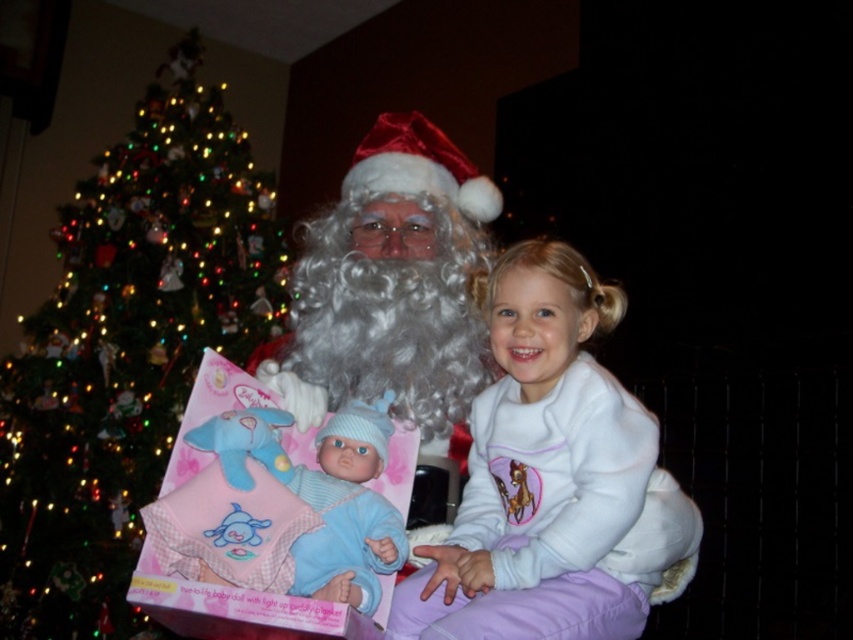
You are standing in front of the festive holiday scene with Santa Claus and the girl. There are two points marked in the image. Point A is at coordinates point (520, 356) and Point B is at coordinates point (408, 154). Which point is closer to you?

Result: Point A at coordinates point (520, 356) is closer to the viewer than point B at coordinates point (408, 154).

You are organizing a holiday photo shoot and need to ensure that the white fleece at center and the white fluffy santa at center are positioned properly. Based on their sizes, which object should be placed closer to the camera to maintain visual balance?

The white fleece at center has a lesser width compared to the white fluffy santa at center. To maintain visual balance, the smaller white fleece at center should be placed closer to the camera while the larger white fluffy santa at center can be positioned slightly farther back.